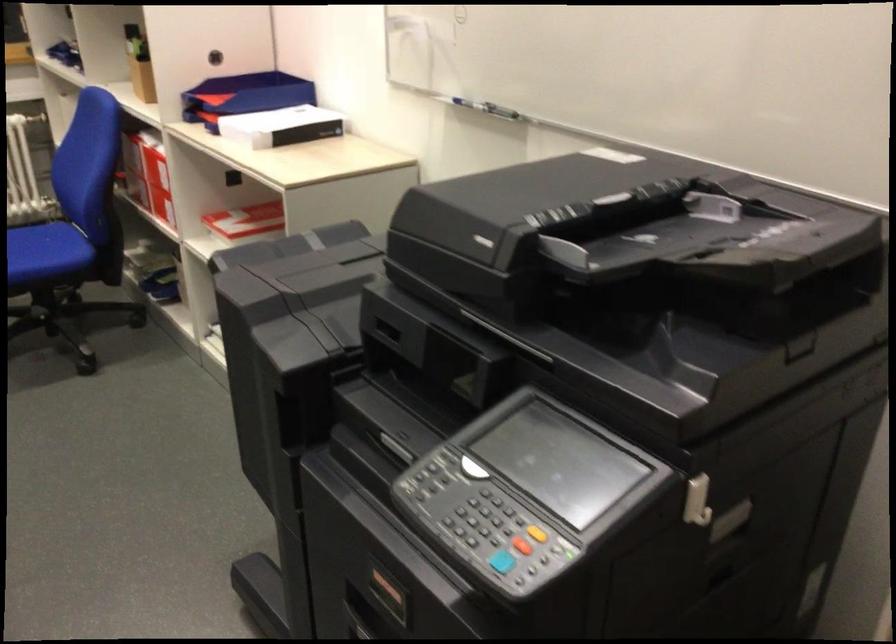
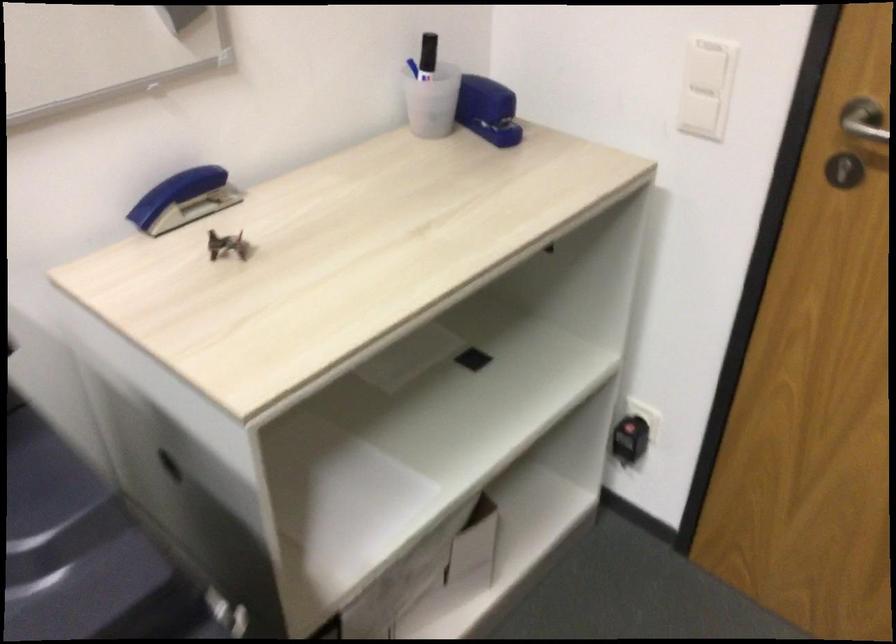
Based on the continuous images, in which direction is the camera rotating?

The camera's rotation is toward right-down.